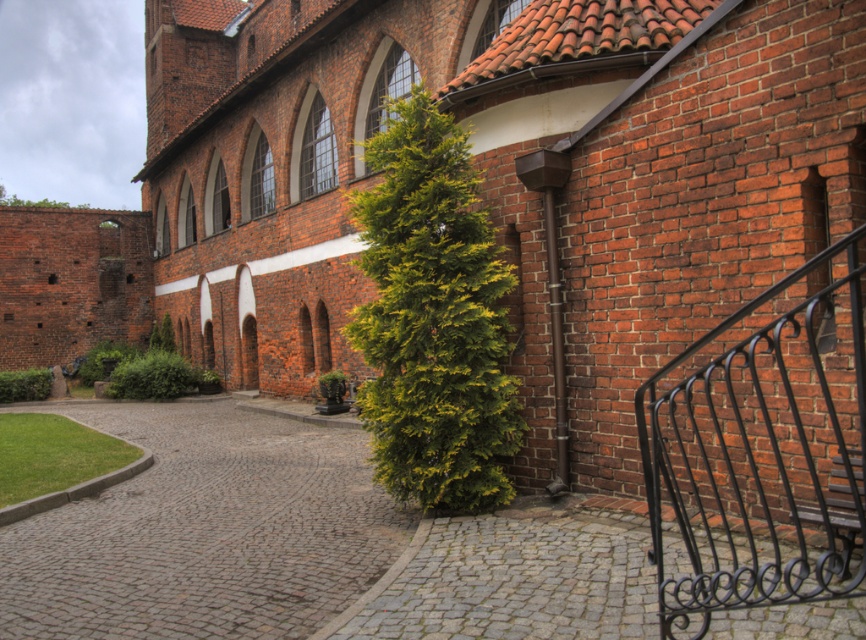
You are standing in the courtyard of the historic brick building. You want to walk to the entrance of the building, which is directly ahead of you. There is a brown cobblestone path at center marked at point (205, 531). Which direction should you walk to reach the entrance?

The entrance is directly ahead of you, so you should walk towards the brown cobblestone path at center marked at point (205, 531).

You are standing in the courtyard and want to walk towards the building. Which object will you encounter first, the black wrought iron balustrade at right or the gray cobblestone path at lower center?

The black wrought iron balustrade at right is in front of the gray cobblestone path at lower center, so you will encounter the black wrought iron balustrade at right first.